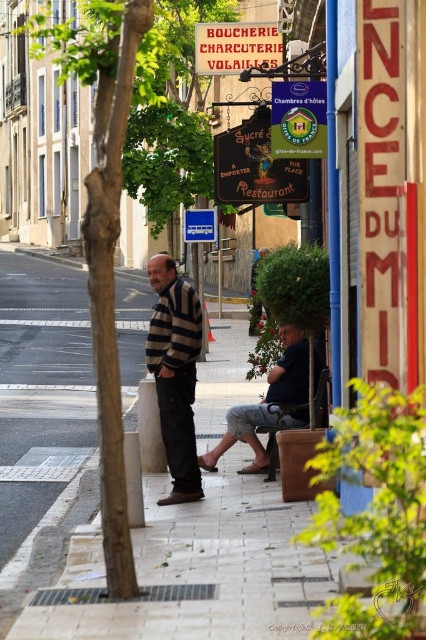
Question: Is striped sweater at center thinner than brown leather stool at lower center?

Choices:
 (A) no
 (B) yes

Answer: (A)

Question: Which of the following is the closest to the observer?

Choices:
 (A) (166, 364)
 (B) (28, 22)
 (C) (267, 428)
 (D) (207, 230)

Answer: (A)

Question: Among these points, which one is farthest from the camera?

Choices:
 (A) (187, 230)
 (B) (91, 58)
 (C) (250, 419)

Answer: (A)

Question: Can you confirm if blue plastic sign at center is thinner than brown leather stool at lower center?

Choices:
 (A) yes
 (B) no

Answer: (B)

Question: Is green leafy tree at center above dark blue jeans at lower center?

Choices:
 (A) yes
 (B) no

Answer: (A)

Question: Considering the real-world distances, which object is farthest from the green leafy tree at center?

Choices:
 (A) brown leather stool at lower center
 (B) striped sweater at center
 (C) blue plastic sign at center

Answer: (B)